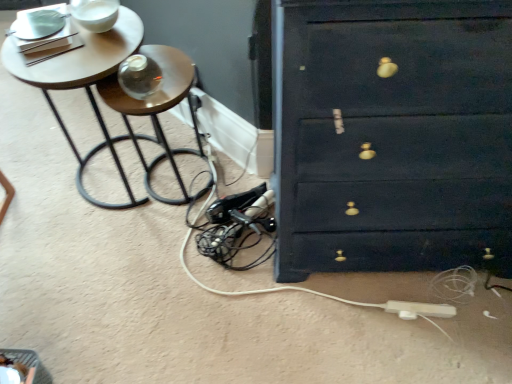
Identify the location of free space above wooden round table at upper left (from a real-world perspective). (77, 54).